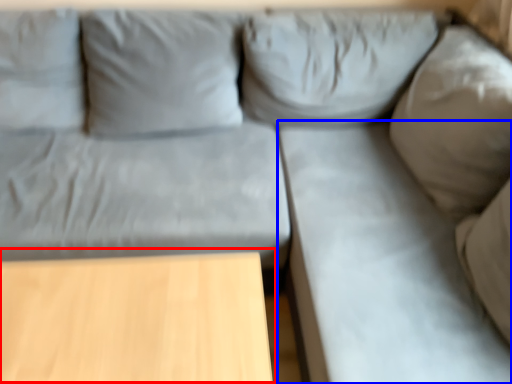
Question: Which object appears farthest to the camera in this image, table (highlighted by a red box) or sheet (highlighted by a blue box)?

Choices:
 (A) table
 (B) sheet

Answer: (A)